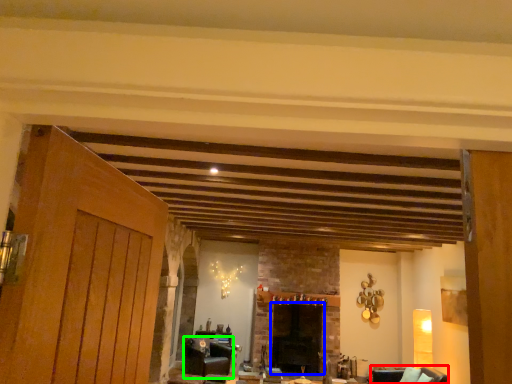
Question: Which object is the farthest from armchair (highlighted by a red box)? Choose among these: fireplace (highlighted by a blue box) or furniture (highlighted by a green box).

Choices:
 (A) fireplace
 (B) furniture

Answer: (B)